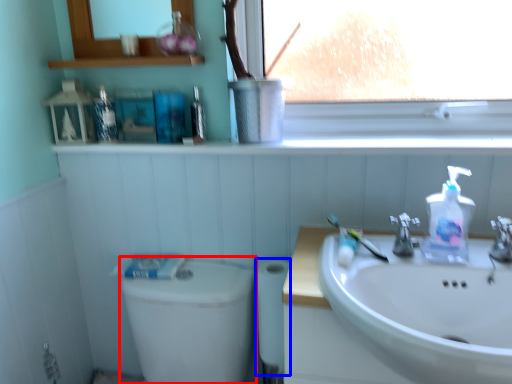
Question: Which point is further to the camera, toilet bowl (highlighted by a red box) or toilet paper (highlighted by a blue box)?

Choices:
 (A) toilet bowl
 (B) toilet paper

Answer: (B)